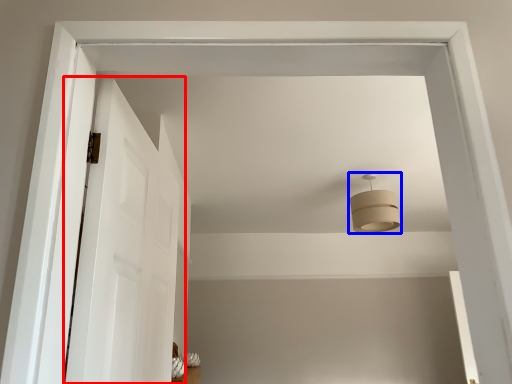
Question: Which point is closer to the camera, door (highlighted by a red box) or fixture (highlighted by a blue box)?

Choices:
 (A) door
 (B) fixture

Answer: (A)